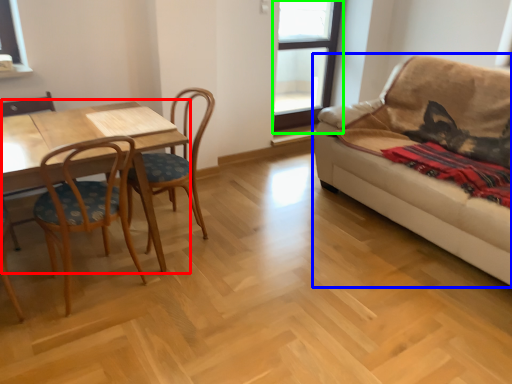
Question: Considering the real-world distances, which object is closest to table (highlighted by a red box)? studio couch (highlighted by a blue box) or window (highlighted by a green box).

Choices:
 (A) studio couch
 (B) window

Answer: (A)